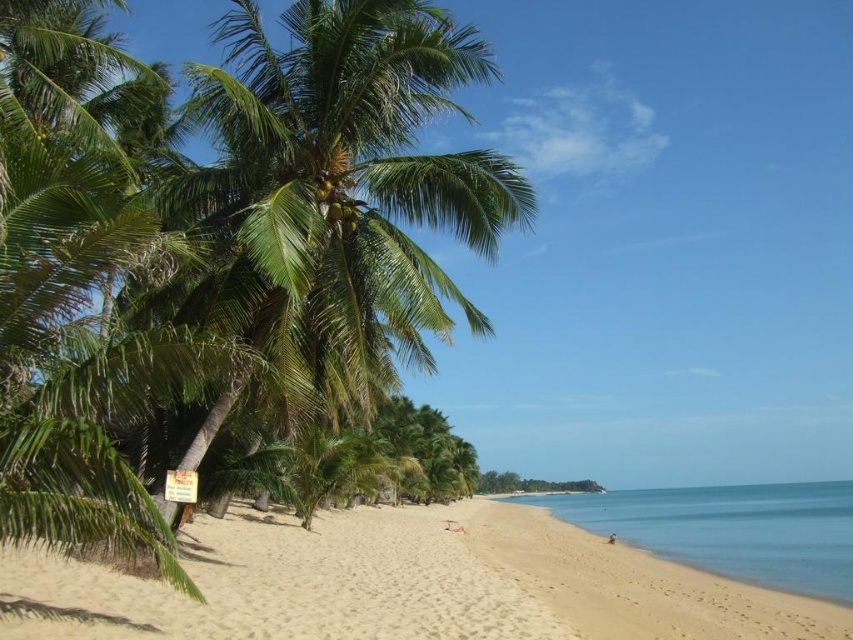
Image resolution: width=853 pixels, height=640 pixels. What do you see at coordinates (402, 586) in the screenshot?
I see `beige sandy beach at center` at bounding box center [402, 586].

Which is in front, point (70, 636) or point (837, 608)?

Point (70, 636)

Describe the element at coordinates (402, 586) in the screenshot. I see `beige sandy beach at center` at that location.

Where is `beige sandy beach at center`? The width and height of the screenshot is (853, 640). beige sandy beach at center is located at coordinates (402, 586).

Can you confirm if green leafy coconut tree at left is positioned below white sandy beach at lower right?

No.

Between green leafy coconut tree at left and white sandy beach at lower right, which one has more height?

green leafy coconut tree at left

Where is `green leafy coconut tree at left`? green leafy coconut tree at left is located at coordinates (219, 253).

Is point (128, 324) farther from viewer compared to point (120, 630)?

Yes.

Consider the image. Can you confirm if green leafy coconut tree at left is positioned to the left of beige sandy beach at center?

Indeed, green leafy coconut tree at left is positioned on the left side of beige sandy beach at center.

Is point (219, 115) farther from camera compared to point (18, 586)?

Yes, point (219, 115) is behind point (18, 586).

Where is `green leafy coconut tree at left`? green leafy coconut tree at left is located at coordinates (219, 253).